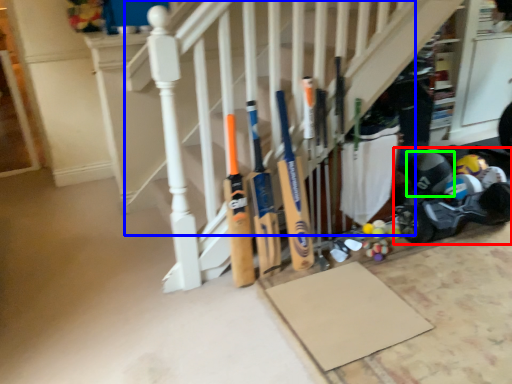
Question: Considering the real-world distances, which object is farthest from baby carriage (highlighted by a red box)? stairs (highlighted by a blue box) or helmet (highlighted by a green box)?

Choices:
 (A) stairs
 (B) helmet

Answer: (A)